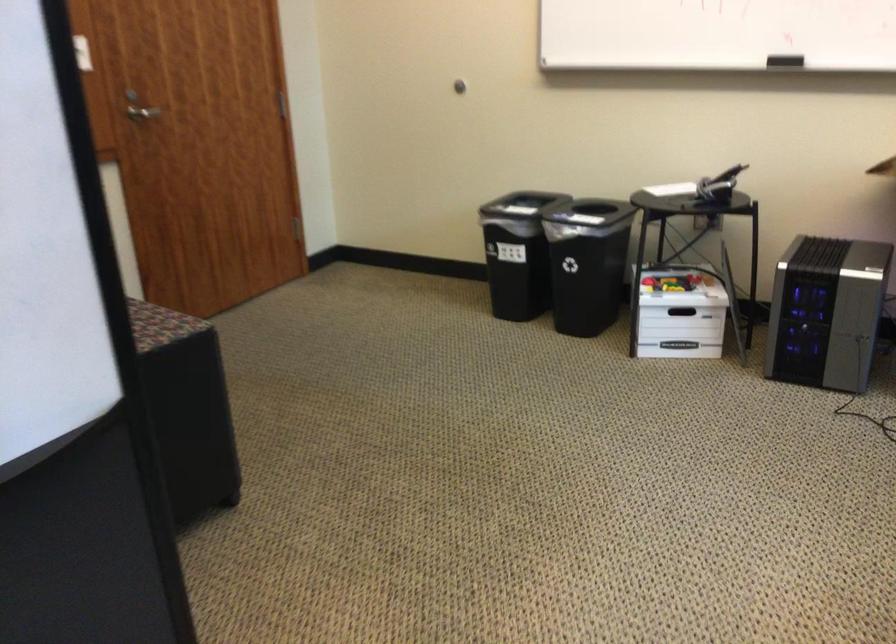
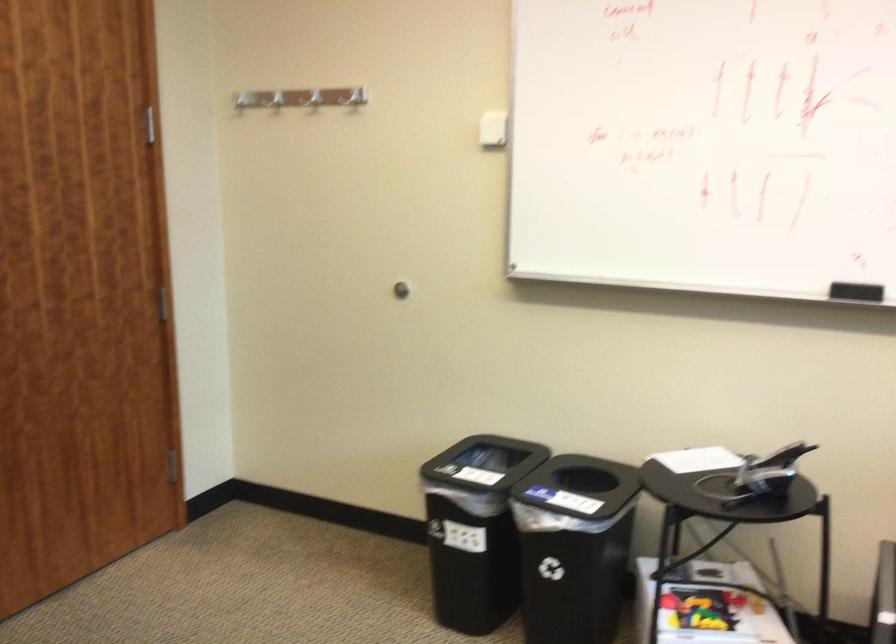
The point at (515, 249) is marked in the first image. Where is the corresponding point in the second image?

(475, 529)